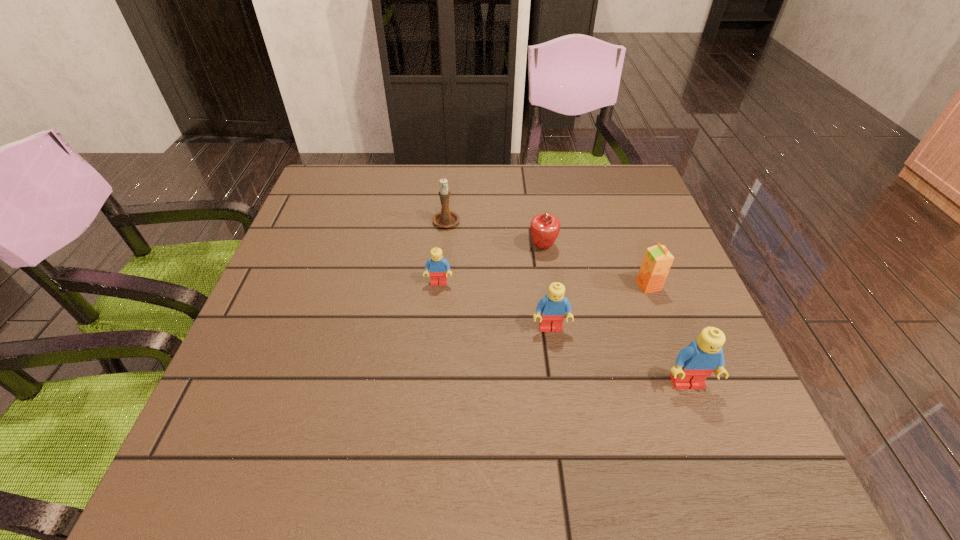
Locate an element on the screen. free point between the orange juice and the apple is located at coordinates click(595, 266).

In order to click on free point between the orange juice and the rightmost Lego in this screenshot , I will do `click(668, 335)`.

Find the location of a particular element. vacant space that is in between the orange juice and the farthest object is located at coordinates click(547, 253).

Image resolution: width=960 pixels, height=540 pixels. Identify the location of vacant region between the nearest object and the orange juice. (668, 335).

You are a GUI agent. You are given a task and a screenshot of the screen. Output one action in this format:
    pyautogui.click(x=<x>, y=<y>)
    Task: Click on the free space between the orange juice and the shortest Lego
    The width and height of the screenshot is (960, 540).
    Given the screenshot: What is the action you would take?
    pyautogui.click(x=543, y=284)

In order to click on object that can be found as the second closest to the nearest object in this screenshot , I will do `click(657, 261)`.

Locate an element on the screen. This screenshot has height=540, width=960. object that can be found as the fifth closest to the orange juice is located at coordinates (446, 218).

Point out which Lego is positioned as the second nearest to the orange juice. Please provide its 2D coordinates. Your answer should be formatted as a tuple, i.e. [(x, y)], where the tuple contains the x and y coordinates of a point satisfying the conditions above.

[(694, 363)]

This screenshot has width=960, height=540. I want to click on the second closest Lego to the candle holder, so click(x=553, y=307).

In order to click on free space that satisfies the following two spatial constraints: 1. on the face of the orange juice; 2. on the left side of the leftmost Lego in this screenshot , I will do `click(439, 286)`.